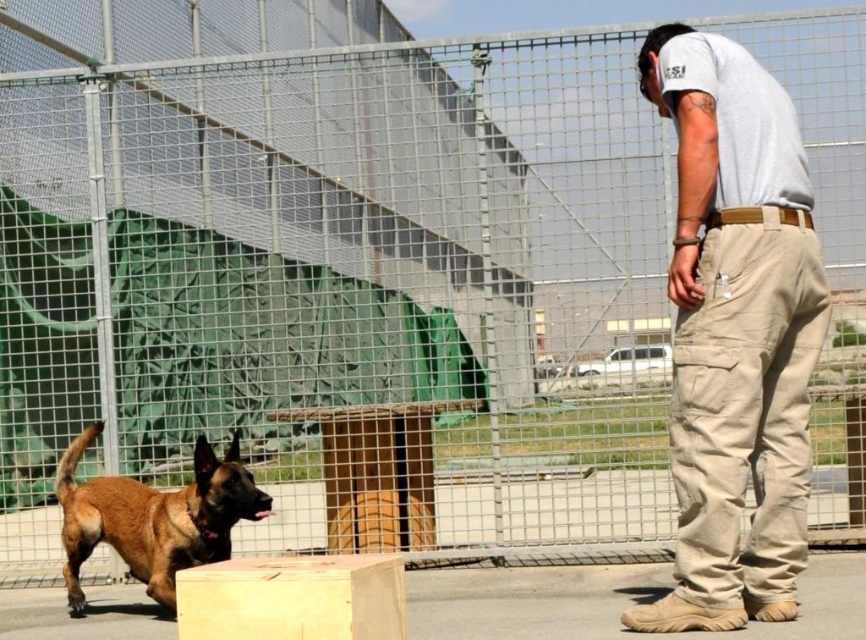
Can you confirm if khaki cotton pants at right is wider than light brown wood at center?

Indeed, khaki cotton pants at right has a greater width compared to light brown wood at center.

Is khaki cotton pants at right above light brown wood at center?

Correct, khaki cotton pants at right is located above light brown wood at center.

Does point (709, 396) lie in front of point (327, 586)?

No, (709, 396) is further to viewer.

Locate an element on the screen. The image size is (866, 640). khaki cotton pants at right is located at coordinates (735, 332).

Does brown fur dog at left have a lesser width compared to light brown wood at center?

No, brown fur dog at left is not thinner than light brown wood at center.

Is brown fur dog at left above light brown wood at center?

Incorrect, brown fur dog at left is not positioned above light brown wood at center.

Measure the distance between point (x=231, y=456) and camera.

Point (x=231, y=456) and camera are 20.48 feet apart from each other.

At what (x,y) coordinates should I click in order to perform the action: click on brown fur dog at left. Please return your answer as a coordinate pair (x, y). The width and height of the screenshot is (866, 640). Looking at the image, I should click on (153, 516).

Does khaki cotton pants at right appear on the left side of brown fur dog at left?

No, khaki cotton pants at right is not to the left of brown fur dog at left.

Is khaki cotton pants at right below brown fur dog at left?

Actually, khaki cotton pants at right is above brown fur dog at left.

Measure the distance between point [677,29] and camera.

Point [677,29] and camera are 5.59 meters apart.

Where is `khaki cotton pants at right`? The width and height of the screenshot is (866, 640). khaki cotton pants at right is located at coordinates (735, 332).